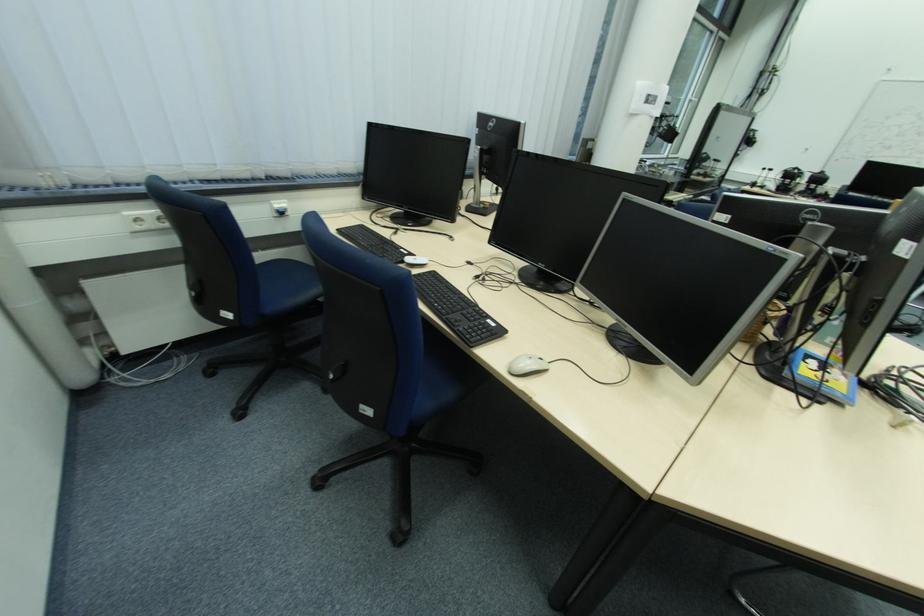
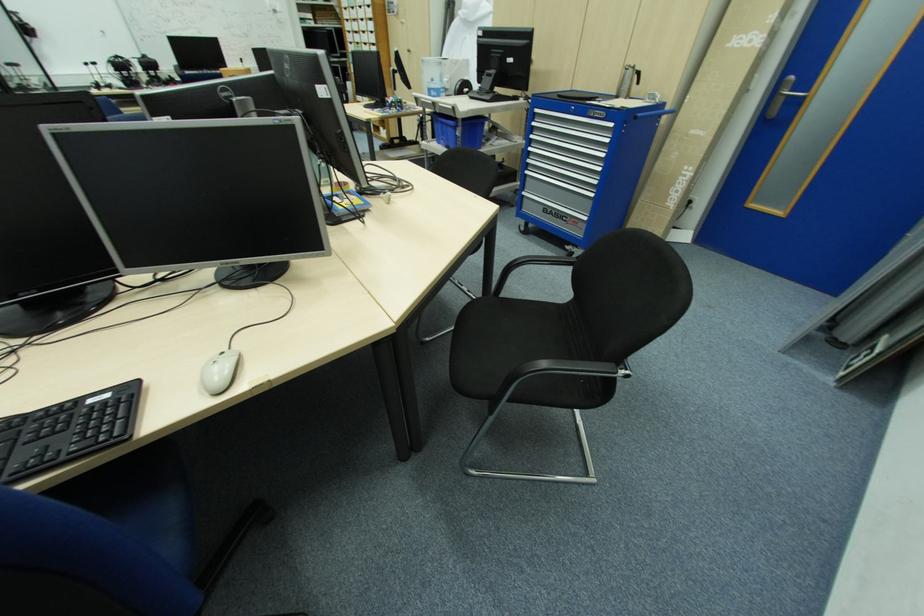
Based on the continuous images, in which direction is the camera rotating?

The rotation direction of the camera is right-down.